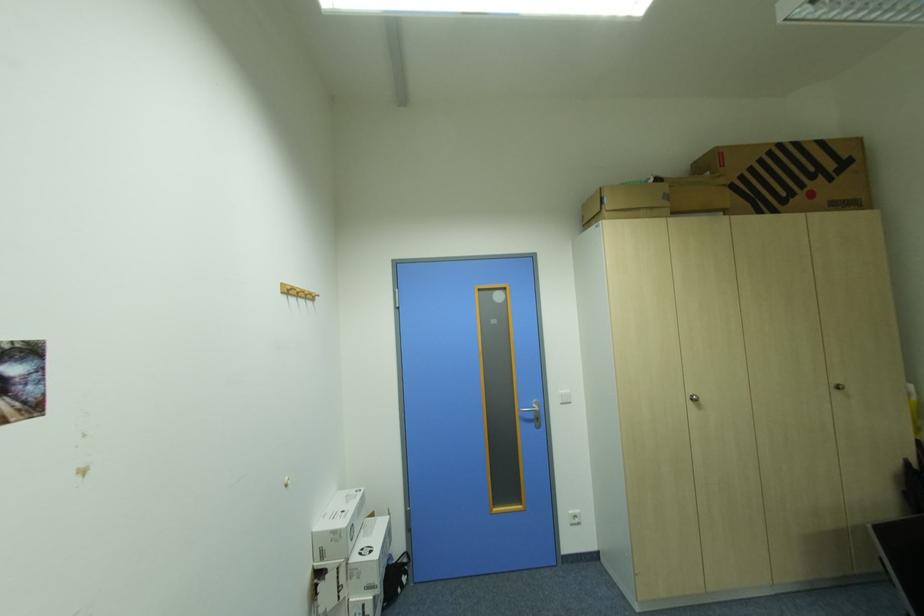
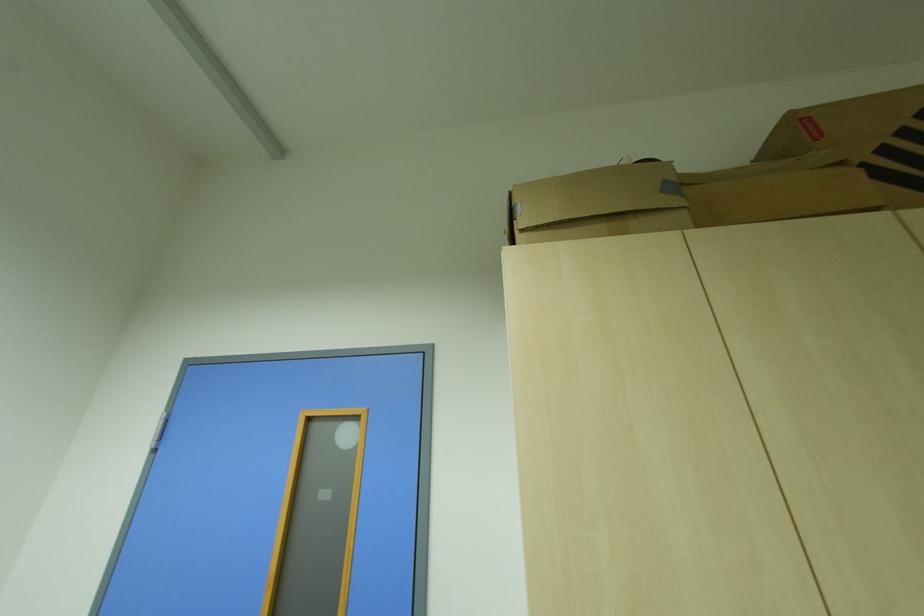
Find the pixel in the second image that matches (x=609, y=188) in the first image.

(517, 195)